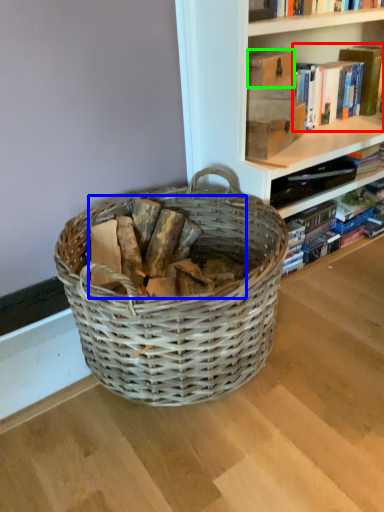
Question: Which object is the farthest from book (highlighted by a red box)? Choose among these: debris (highlighted by a blue box) or paperback book (highlighted by a green box).

Choices:
 (A) debris
 (B) paperback book

Answer: (A)